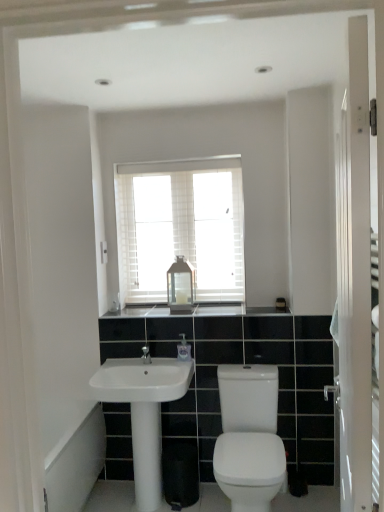
Locate an element on the screen. The width and height of the screenshot is (384, 512). vacant space underneath clear glass lantern at center (from a real-world perspective) is located at coordinates (178, 304).